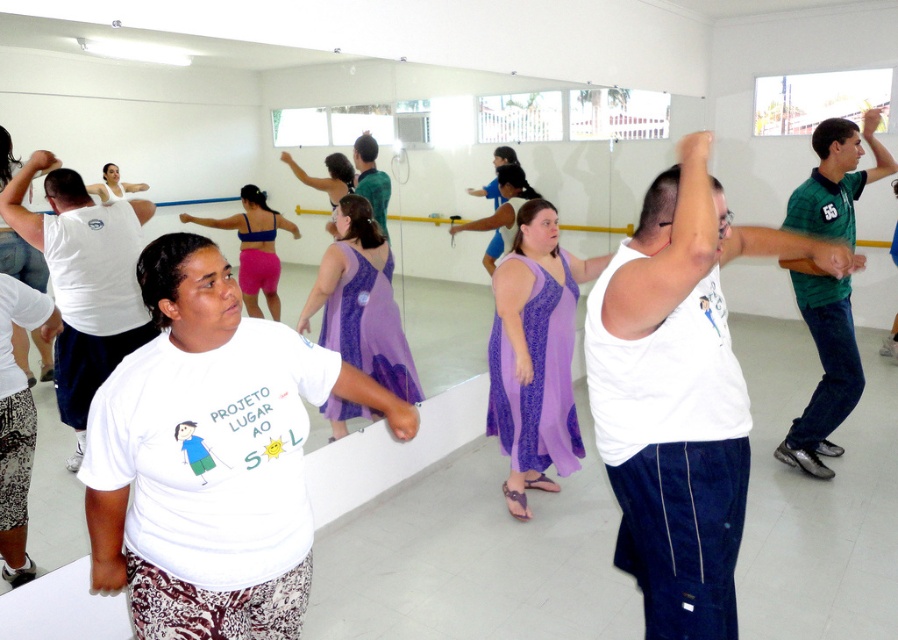
Who is shorter, purple satin dress at center or matte purple dress at center?

matte purple dress at center is shorter.

Is purple satin dress at center further to camera compared to matte purple dress at center?

Yes, it is behind matte purple dress at center.

Does point (575, 452) come in front of point (282, 224)?

No, (575, 452) is further to viewer.

Locate an element on the screen. The height and width of the screenshot is (640, 898). purple satin dress at center is located at coordinates coord(535,355).

Between matte purple dress at center and white fabric at upper center, which one has less height?

white fabric at upper center is shorter.

Is matte purple dress at center positioned before white fabric at upper center?

No, matte purple dress at center is further to the viewer.

Who is more distant from viewer, (271, 278) or (113, 192)?

Positioned behind is point (271, 278).

You are a GUI agent. You are given a task and a screenshot of the screen. Output one action in this format:
    pyautogui.click(x=<x>, y=<y>)
    Task: Click on the matte purple dress at center
    The image size is (898, 640).
    Given the screenshot: What is the action you would take?
    tap(254, 248)

Can you confirm if purple sheer dress at center is bigger than matte purple dress at center?

Indeed, purple sheer dress at center has a larger size compared to matte purple dress at center.

Does purple sheer dress at center have a lesser width compared to matte purple dress at center?

Incorrect, purple sheer dress at center's width is not less than matte purple dress at center's.

Is point (379, 314) positioned in front of point (275, 289)?

That is False.

Where is `purple sheer dress at center`? purple sheer dress at center is located at coordinates (361, 301).